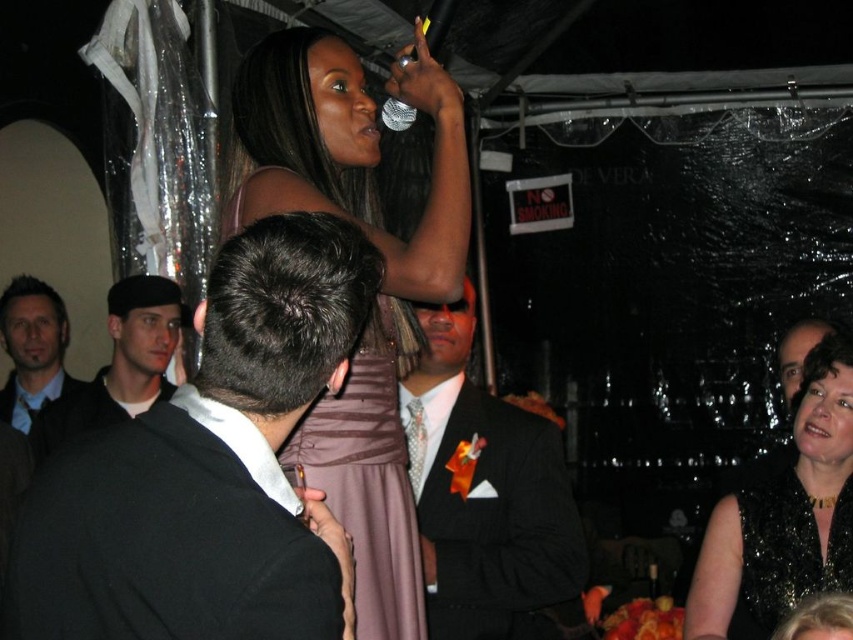
Does black sequined dress at lower right have a greater width compared to smooth black suit at center?

No.

Is point (769, 586) positioned before point (782, 397)?

That is True.

Find the location of a particular element. This screenshot has width=853, height=640. black sequined dress at lower right is located at coordinates (784, 545).

Does black satin suit at center appear on the left side of matte black suit at left?

In fact, black satin suit at center is to the right of matte black suit at left.

This screenshot has height=640, width=853. I want to click on black satin suit at center, so click(210, 468).

What do you see at coordinates (210, 468) in the screenshot? I see `black satin suit at center` at bounding box center [210, 468].

Identify the location of black satin suit at center. (210, 468).

Does shiny black suit at center appear on the left side of black matte cap at left?

No, shiny black suit at center is not to the left of black matte cap at left.

Which of these two, shiny black suit at center or black matte cap at left, stands taller?

shiny black suit at center

Which is in front, point (431, 323) or point (67, 396)?

Positioned in front is point (431, 323).

Find the location of a particular element. The height and width of the screenshot is (640, 853). shiny black suit at center is located at coordinates (485, 496).